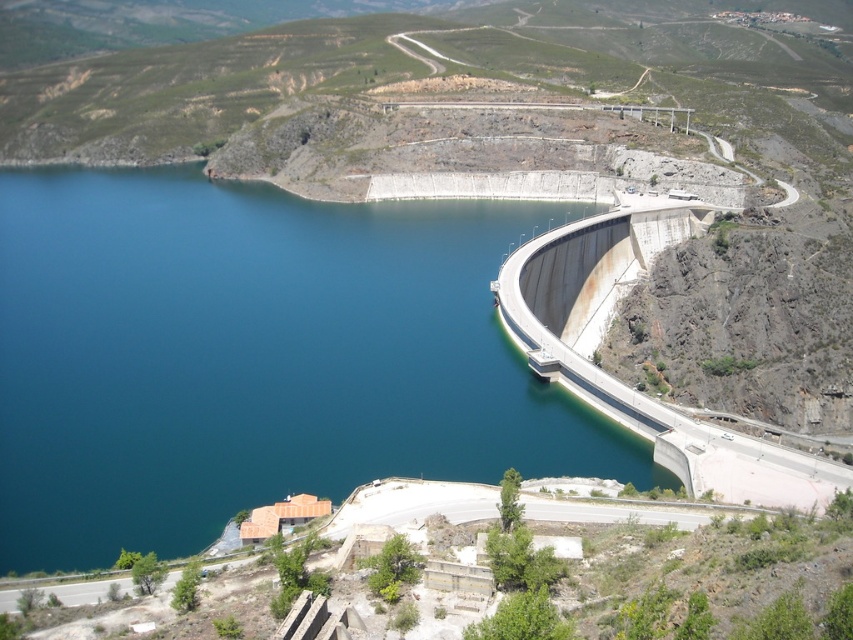
Question: Is blue concrete dam at center above concrete dam at right?

Choices:
 (A) no
 (B) yes

Answer: (B)

Question: Can you confirm if blue concrete dam at center is positioned above concrete dam at right?

Choices:
 (A) yes
 (B) no

Answer: (A)

Question: Which of the following is the closest to the observer?

Choices:
 (A) blue concrete dam at center
 (B) concrete dam at right

Answer: (A)

Question: Observing the image, what is the correct spatial positioning of blue concrete dam at center in reference to concrete dam at right?

Choices:
 (A) left
 (B) right

Answer: (A)

Question: Which point is farther to the camera?

Choices:
 (A) blue concrete dam at center
 (B) concrete dam at right

Answer: (B)